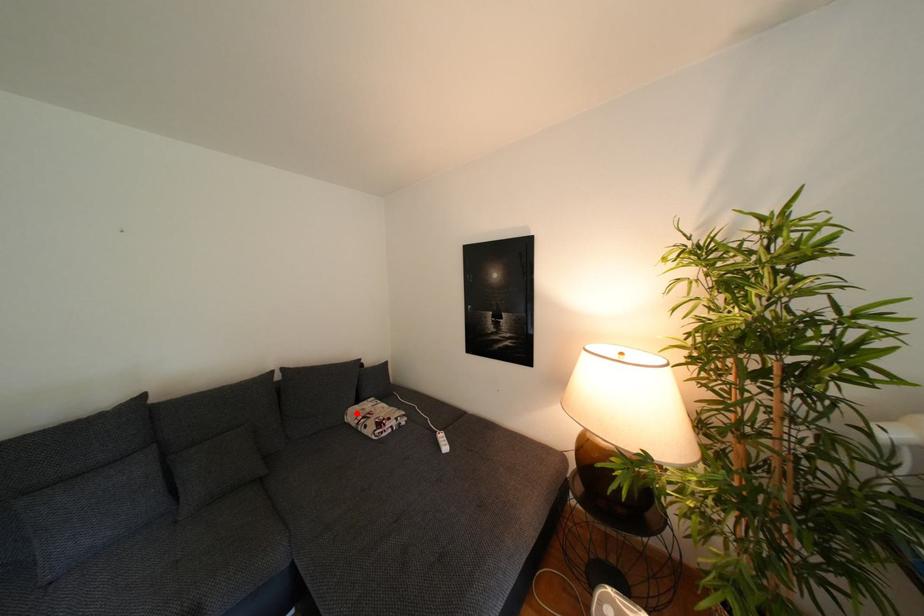
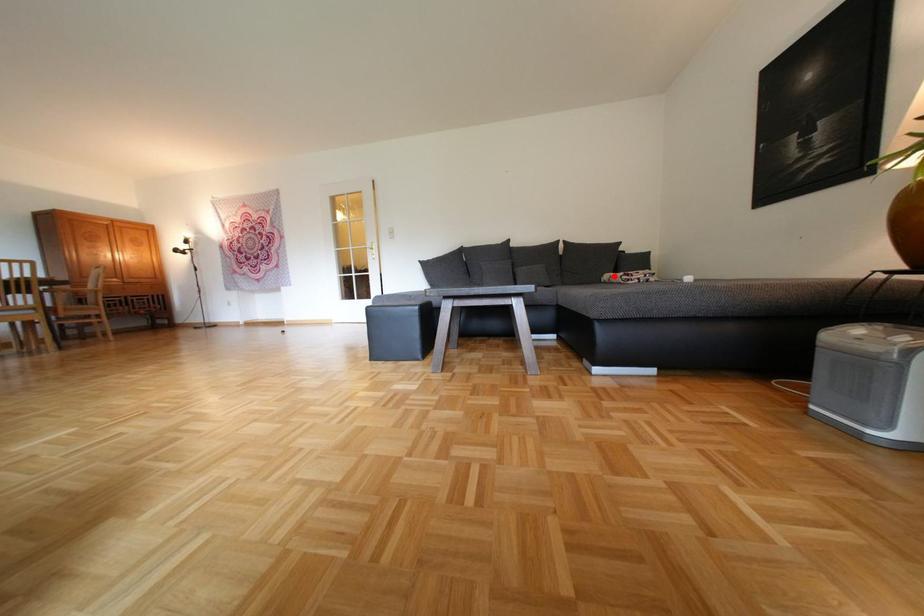
I am providing you with two images of the same scene from different viewpoints. A red point is marked on the first image and another point is marked on the second image. Does the point marked in image1 correspond to the same location as the one in image2?

Yes